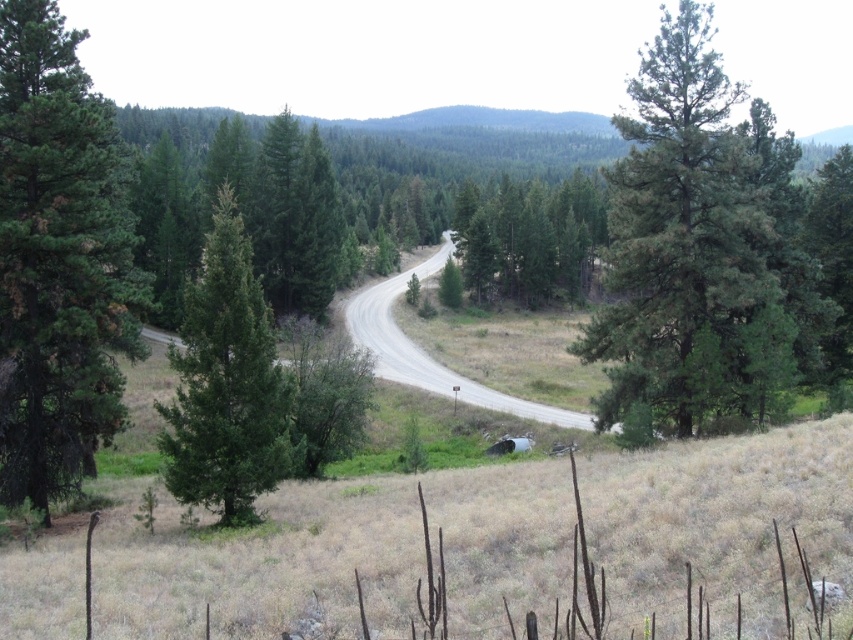
Question: Which of these objects is positioned farthest from the green matte tree at center?

Choices:
 (A) dark green pine tree at left
 (B) green needle-like tree at upper right
 (C) gray asphalt road at center
 (D) green rough bark tree at left

Answer: (D)

Question: Among these points, which one is farthest from the camera?

Choices:
 (A) (229, 337)
 (B) (347, 307)

Answer: (B)

Question: Does green matte tree at center appear on the right side of gray asphalt road at center?

Choices:
 (A) no
 (B) yes

Answer: (B)

Question: Does green rough bark tree at left lie behind dark green pine tree at left?

Choices:
 (A) no
 (B) yes

Answer: (A)

Question: Which object appears closest to the camera in this image?

Choices:
 (A) green needle-like tree at upper right
 (B) dark green pine tree at left

Answer: (B)

Question: Does green needle-like tree at upper right appear on the left side of green rough bark tree at left?

Choices:
 (A) yes
 (B) no

Answer: (B)